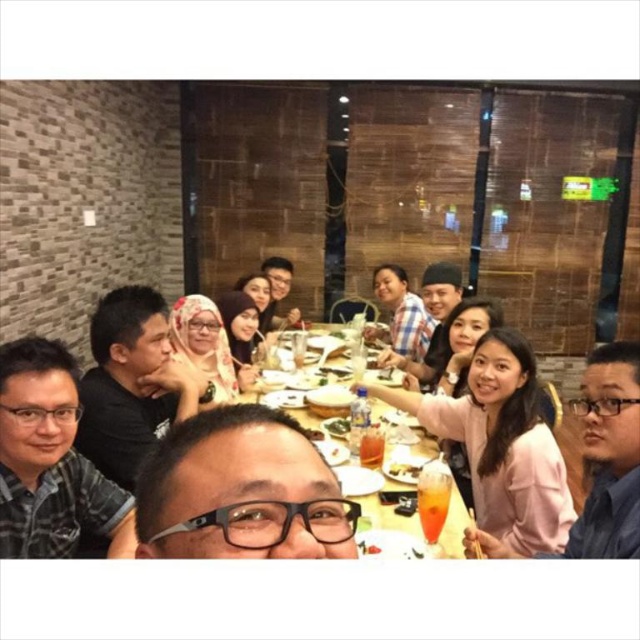
You are a photographer positioned behind the dining table. You want to take a photo that clearly shows both the matte black shirt at center and the black matte shirt at left. Which shirt should you focus on to ensure both are in sharp focus?

You should focus on the matte black shirt at center because it is closer to the viewer than the black matte shirt at left, so focusing on it will keep both in focus.

You are a photographer trying to capture a closeup shot of the orange drink. There are two points marked in the image. One is at point (x=67, y=547) and the other is at point (x=108, y=440). Which point should you focus on to get the best closeup of the orange drink?

Point (x=67, y=547) is closer to the camera than point (x=108, y=440), so focusing on point (x=67, y=547) will provide a better closeup of the orange drink.

You are a photographer standing at the center of the scene. You want to take a photo that includes both the point at coordinate (81, 490) and the point at coordinate (605, 435). Which point should you focus on to ensure both are in sharp focus?

You should focus on the point at coordinate (81, 490) because it is closer to you than the other point, which is further away. This way, both points will be in focus as the depth of field will cover the distance between them.